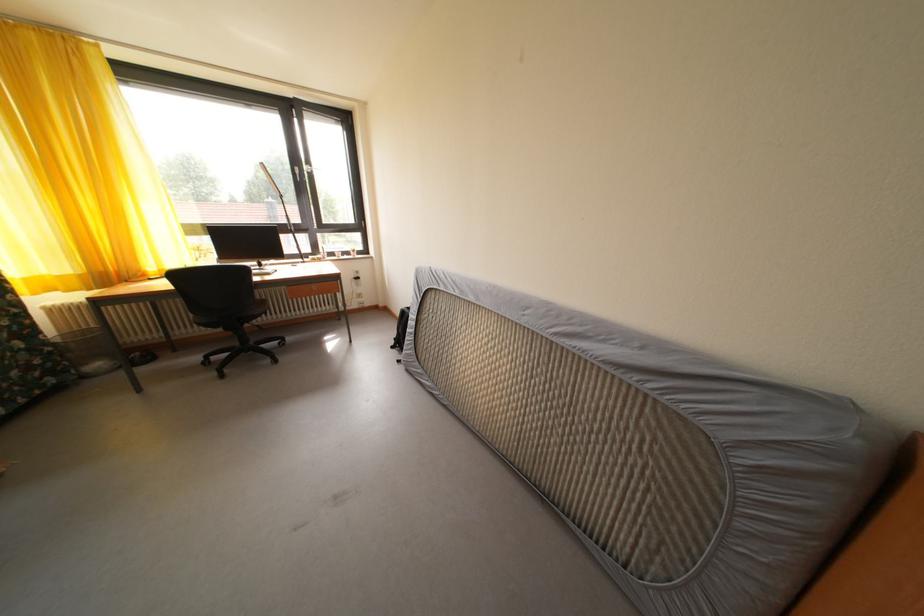
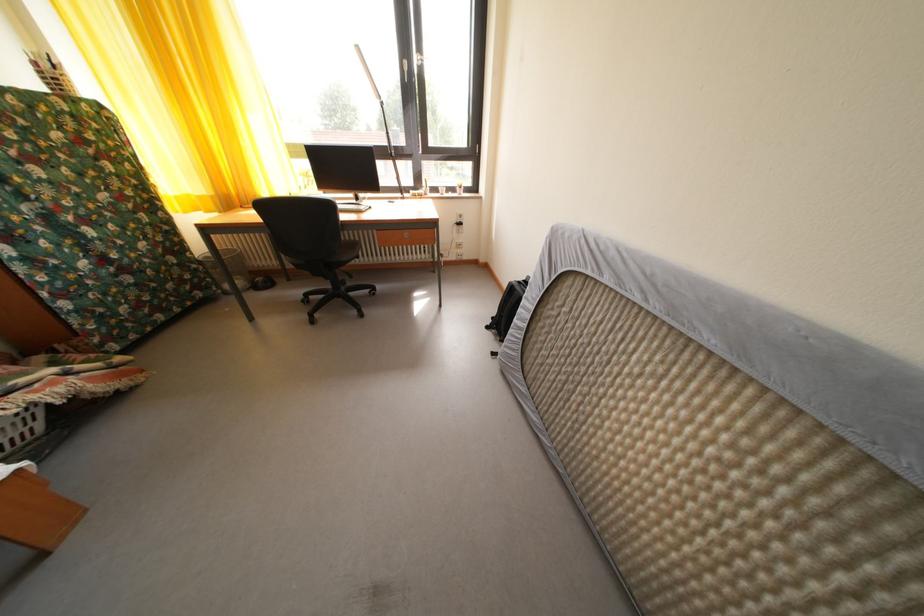
In the second image, find the point that corresponds to (x=451, y=294) in the first image.

(615, 285)